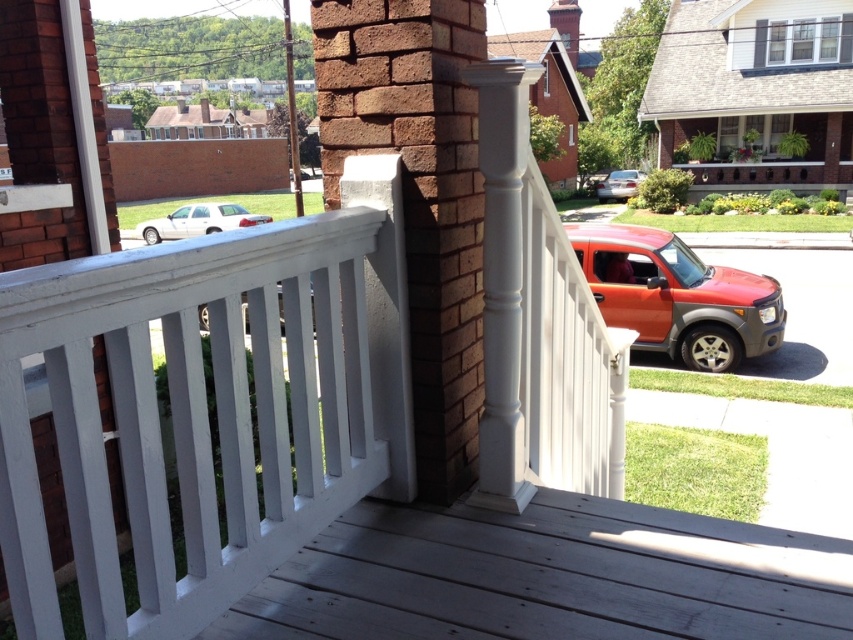
Question: Among these points, which one is nearest to the camera?

Choices:
 (A) (169, 218)
 (B) (312, 314)

Answer: (B)

Question: Which point is closer to the camera?

Choices:
 (A) (247, 305)
 (B) (654, 292)

Answer: (A)

Question: Can you confirm if brown brick pillar at center is positioned below white matte sedan at center?

Choices:
 (A) yes
 (B) no

Answer: (A)

Question: Can you confirm if shiny orange suv at right is positioned above silver metallic sedan at center-right?

Choices:
 (A) no
 (B) yes

Answer: (A)

Question: Does brown brick pillar at center have a smaller size compared to white matte sedan at center?

Choices:
 (A) no
 (B) yes

Answer: (B)

Question: Among these points, which one is farthest from the camera?

Choices:
 (A) (242, 324)
 (B) (613, 184)
 (C) (213, 212)

Answer: (B)